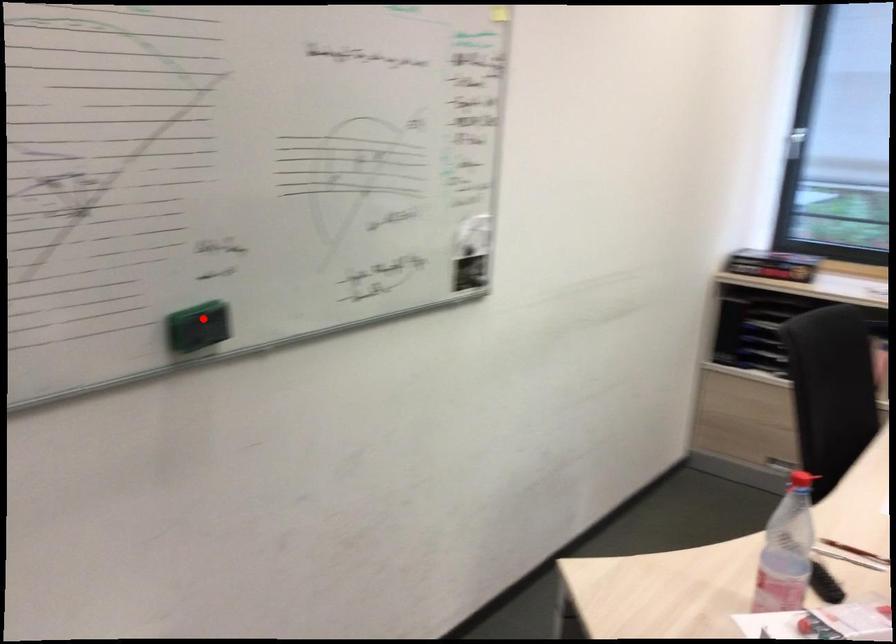
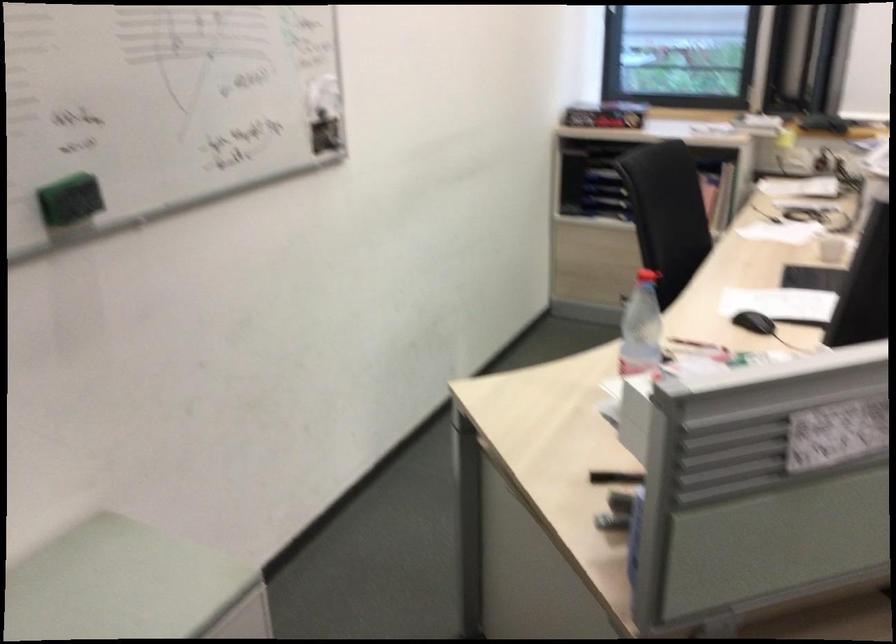
Where in the second image is the point corresponding to the highlighted location from the first image?

(70, 200)